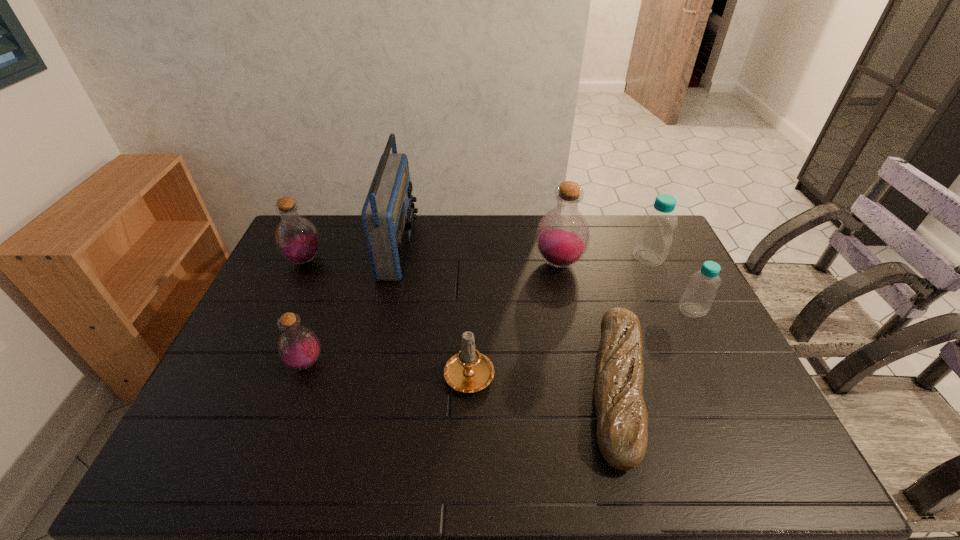
Identify which object is the nearest to the third object from left to right. Please provide its 2D coordinates. Your answer should be formatted as a tuple, i.e. [(x, y)], where the tuple contains the x and y coordinates of a point satisfying the conditions above.

[(297, 239)]

Locate which object ranks second in proximity to the third bottle from right to left. Please provide its 2D coordinates. Your answer should be formatted as a tuple, i.e. [(x, y)], where the tuple contains the x and y coordinates of a point satisfying the conditions above.

[(622, 419)]

Locate which bottle is the fifth closest to the candle. Please provide its 2D coordinates. Your answer should be formatted as a tuple, i.e. [(x, y)], where the tuple contains the x and y coordinates of a point satisfying the conditions above.

[(654, 237)]

Select which bottle is the closest to the third bottle from right to left. Please provide its 2D coordinates. Your answer should be formatted as a tuple, i.e. [(x, y)], where the tuple contains the x and y coordinates of a point satisfying the conditions above.

[(654, 237)]

What are the coordinates of `purple bottle that is the nearest to the candle` in the screenshot? It's located at (562, 237).

Select which purple bottle appears as the second closest to the nearest bottle. Please provide its 2D coordinates. Your answer should be formatted as a tuple, i.e. [(x, y)], where the tuple contains the x and y coordinates of a point satisfying the conditions above.

[(562, 237)]

At what (x,y) coordinates should I click in order to perform the action: click on vacant space that satisfies the following two spatial constraints: 1. on the front side of the fourth bottle from right to left; 2. on the left side of the candle. Please return your answer as a coordinate pair (x, y). Looking at the image, I should click on (303, 371).

Image resolution: width=960 pixels, height=540 pixels. What are the coordinates of `free space that satisfies the following two spatial constraints: 1. on the front side of the candle; 2. on the left side of the shortest object` in the screenshot? It's located at (468, 387).

Find the location of `vacant point that satisfies the following two spatial constraints: 1. on the back side of the biggest purple bottle; 2. on the front panel of the third object from left to right`. vacant point that satisfies the following two spatial constraints: 1. on the back side of the biggest purple bottle; 2. on the front panel of the third object from left to right is located at coordinates (555, 247).

Identify the location of free space that satisfies the following two spatial constraints: 1. on the front panel of the baguet; 2. on the left side of the radio receiver. Image resolution: width=960 pixels, height=540 pixels. (368, 387).